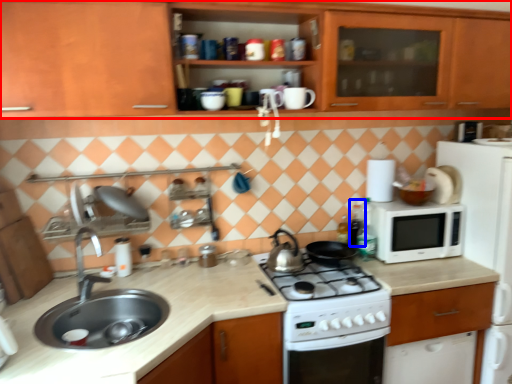
Question: Which object is closer to the camera taking this photo, cabinetry (highlighted by a red box) or bottle (highlighted by a blue box)?

Choices:
 (A) cabinetry
 (B) bottle

Answer: (A)